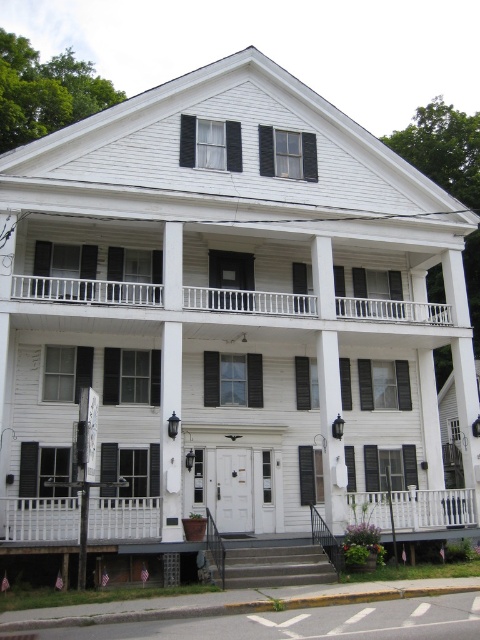
You are standing in front of the building and want to enter through the entrance. Which object is closer to the entrance, the white wooden porch at upper center or the black wood shutter at center?

The black wood shutter at center is closer to the entrance because the white wooden porch at upper center is positioned to the right side of the black wood shutter at center, meaning the shutter is between the entrance and the porch.

You are standing in front of the building and want to take a photo of the entrance. The white painted wood balustrade at lower center and the black wood shutter at center are both in your view. Which object is closer to you, the photographer?

The white painted wood balustrade at lower center is closer to the viewer than the black wood shutter at center, so it is closer to you.

You are standing on the ground floor of the building and looking up at the entrance. There is a point marked at coordinates (x=39, y=518). What is the object located at this point?

The point at coordinates (x=39, y=518) marks the white painted wood balustrade at lower center.